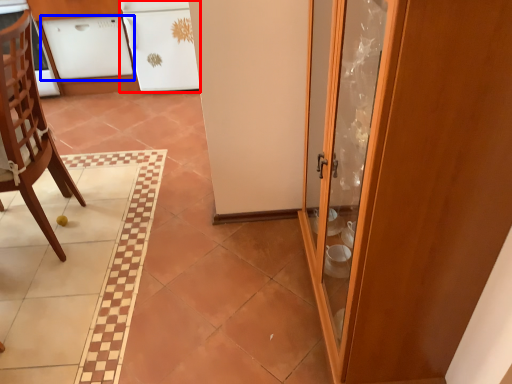
Question: Among these objects, which one is nearest to the camera, cabinetry (highlighted by a red box) or cabinetry (highlighted by a blue box)?

Choices:
 (A) cabinetry
 (B) cabinetry

Answer: (A)